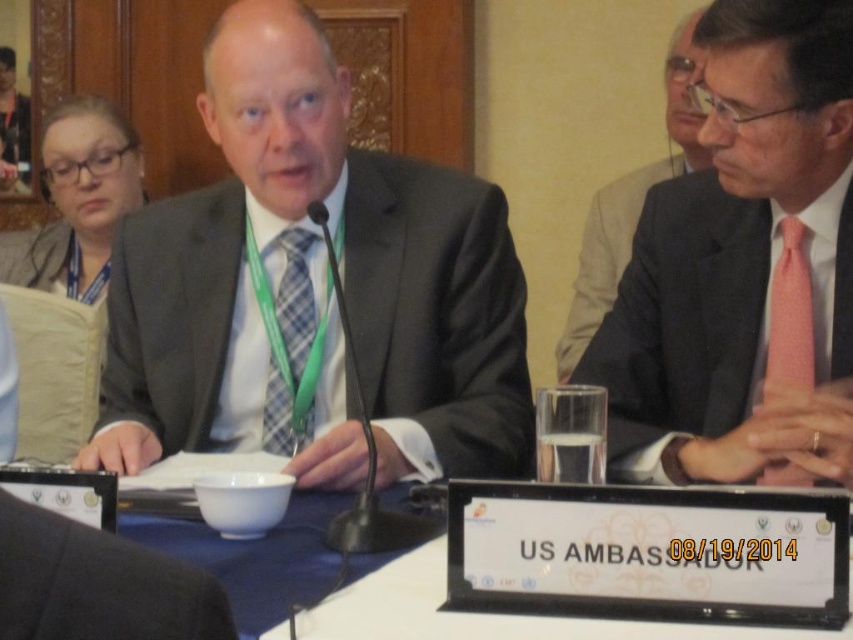
Question: Estimate the real-world distances between objects in this image. Which object is farther from the pink silk tie at right?

Choices:
 (A) matte black suit at center
 (B) pink silk suit at right
 (C) black fabric business suit at lower left

Answer: (C)

Question: Which of the following is the farthest from the observer?

Choices:
 (A) (144, 602)
 (B) (276, 401)

Answer: (B)

Question: Can you confirm if black fabric business suit at lower left is wider than pink dotted tie at right?

Choices:
 (A) yes
 (B) no

Answer: (B)

Question: Is pink silk tie at right above black fabric business suit at lower left?

Choices:
 (A) no
 (B) yes

Answer: (B)

Question: Can you confirm if pink silk tie at right is wider than plaid fabric tie at center?

Choices:
 (A) yes
 (B) no

Answer: (A)

Question: Which object appears farthest from the camera in this image?

Choices:
 (A) pink dotted tie at right
 (B) matte black suit at center
 (C) plaid fabric tie at center
 (D) pink silk tie at right

Answer: (C)